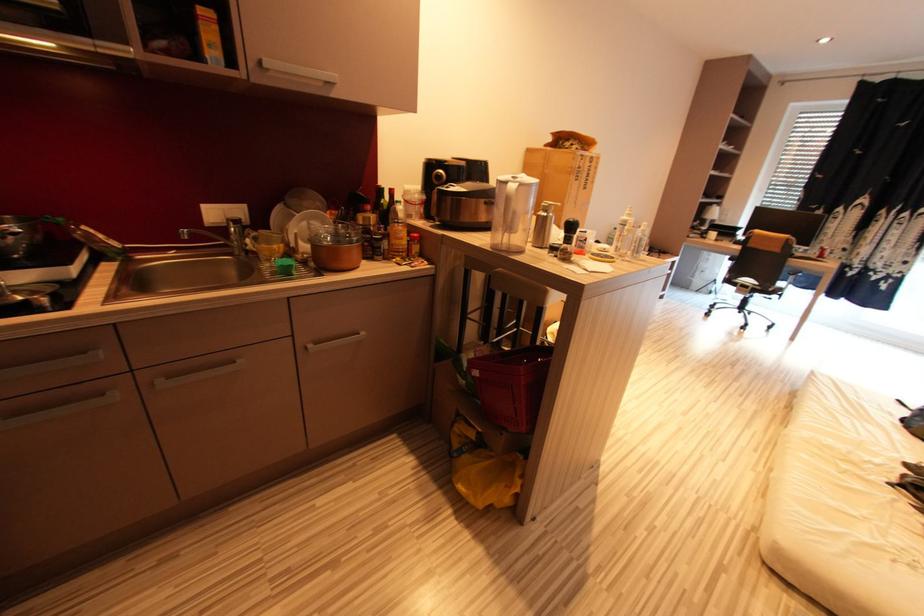
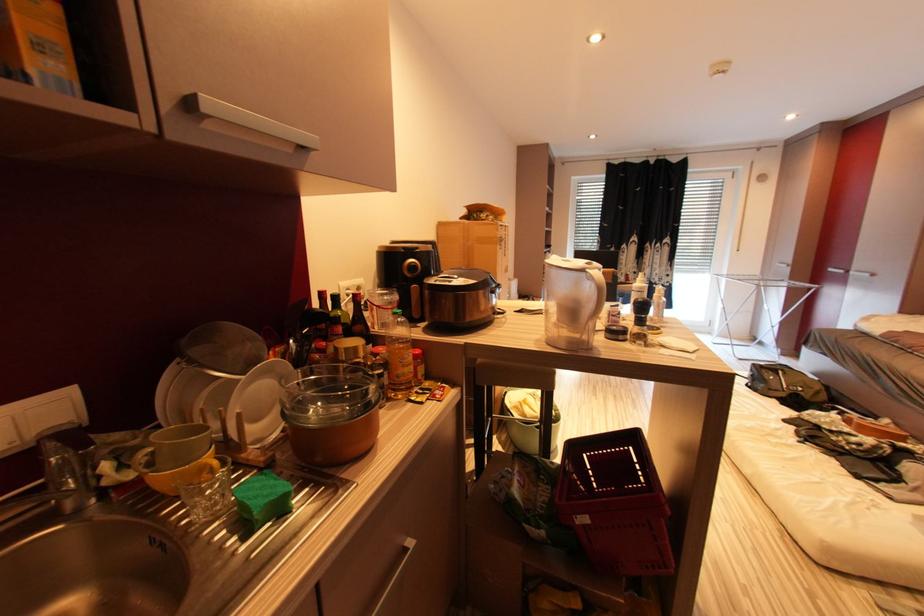
Question: The camera is either moving clockwise (left) or counter-clockwise (right) around the object. The first image is from the beginning of the video and the second image is from the end. Is the camera moving left or right when shooting the video?

Choices:
 (A) Left
 (B) Right

Answer: (A)